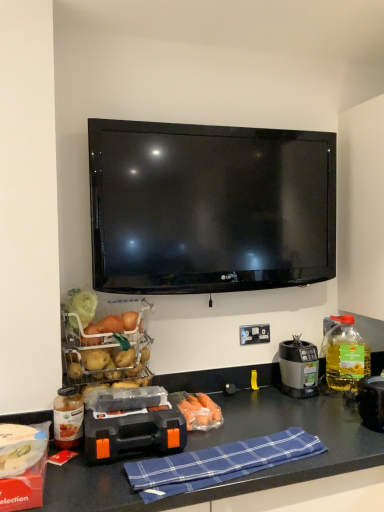
This screenshot has height=512, width=384. Identify the location of orange plastic toolbox at center. (134, 426).

Find the location of a particular element. black plastic blender at right is located at coordinates (298, 368).

Based on the photo, how much space does translucent glass jar at lower left, the first bottle in the front-to-back sequence, occupy vertically?

translucent glass jar at lower left, the first bottle in the front-to-back sequence, is 7.29 inches in height.

In order to face translucent glass jar at lower left, the 1th bottle in the left-to-right sequence, should I rotate leftwards or rightwards?

Turn left approximately 16.451 degrees to face it.

I want to click on yellow translucent bottle at right, the second bottle viewed from the left, so click(x=345, y=355).

The width and height of the screenshot is (384, 512). In order to click on orange plastic toolbox at center in this screenshot , I will do `click(134, 426)`.

Can you tell me how much black plastic electrical outlet at center and blue plaid cloth at lower center differ in facing direction?

6.62 degrees separate the facing orientations of black plastic electrical outlet at center and blue plaid cloth at lower center.

Who is shorter, black plastic electrical outlet at center or blue plaid cloth at lower center?

Standing shorter between the two is blue plaid cloth at lower center.

In order to click on material in front of the black plastic electrical outlet at center in this screenshot , I will do `click(218, 463)`.

Can you see black plastic electrical outlet at center touching blue plaid cloth at lower center?

No.

Which is less distant, (x=60, y=401) or (x=315, y=361)?

Clearly, point (x=60, y=401) is closer to the camera than point (x=315, y=361).

Looking at their sizes, would you say translucent glass jar at lower left, which appears as the 2th bottle when viewed from the back, is wider or thinner than black plastic blender at right?

Clearly, translucent glass jar at lower left, which appears as the 2th bottle when viewed from the back, has less width compared to black plastic blender at right.

Is translucent glass jar at lower left, which appears as the 2th bottle when viewed from the back, oriented away from black plastic blender at right?

No, translucent glass jar at lower left, which appears as the 2th bottle when viewed from the back, is not facing the opposite direction of black plastic blender at right.

Considering their positions, is translucent glass jar at lower left, which appears as the 2th bottle when viewed from the back, located in front of or behind black plastic blender at right?

Clearly, translucent glass jar at lower left, which appears as the 2th bottle when viewed from the back, is in front of black plastic blender at right.

Can you confirm if blue plaid cloth at lower center is smaller than orange plastic toolbox at center?

Correct, blue plaid cloth at lower center occupies less space than orange plastic toolbox at center.

Which is nearer, (148, 472) or (141, 440)?

Point (148, 472) is positioned closer to the camera compared to point (141, 440).

Looking at their sizes, would you say blue plaid cloth at lower center is wider or thinner than orange plastic toolbox at center?

Considering their sizes, blue plaid cloth at lower center looks slimmer than orange plastic toolbox at center.

Between yellow translucent bottle at right, which is the second bottle in front-to-back order, and black plastic blender at right, which one has larger width?

yellow translucent bottle at right, which is the second bottle in front-to-back order, is wider.

From a real-world perspective, is yellow translucent bottle at right, which ranks as the 1th bottle in back-to-front order, under black plastic blender at right?

No, from a real-world perspective, yellow translucent bottle at right, which ranks as the 1th bottle in back-to-front order, is not under black plastic blender at right.

Considering the sizes of objects yellow translucent bottle at right, the second bottle viewed from the left, and black plastic blender at right in the image provided, who is shorter, yellow translucent bottle at right, the second bottle viewed from the left, or black plastic blender at right?

Standing shorter between the two is black plastic blender at right.

Can you tell me how much translucent glass jar at lower left, the first bottle in the front-to-back sequence, and orange plastic toolbox at center differ in facing direction?

translucent glass jar at lower left, the first bottle in the front-to-back sequence, and orange plastic toolbox at center are facing 0.432 degrees away from each other.

Which point is more distant from viewer, (62, 394) or (90, 452)?

Point (62, 394)

Can you see translucent glass jar at lower left, the first bottle in the front-to-back sequence, touching orange plastic toolbox at center?

There is a gap between translucent glass jar at lower left, the first bottle in the front-to-back sequence, and orange plastic toolbox at center.

Considering the relative positions of translucent glass jar at lower left, which appears as the 2th bottle when viewed from the back, and orange plastic toolbox at center in the image provided, is translucent glass jar at lower left, which appears as the 2th bottle when viewed from the back, to the left of orange plastic toolbox at center from the viewer's perspective?

Yes.

Would you say matte red box at lower left is to the left or to the right of yellow translucent bottle at right, which is the second bottle in front-to-back order, in the picture?

matte red box at lower left is positioned on yellow translucent bottle at right, which is the second bottle in front-to-back order,'s left side.

From a real-world perspective, is matte red box at lower left on yellow translucent bottle at right, marked as the 1th bottle in a right-to-left arrangement?

No.

Which object is wider, matte red box at lower left or yellow translucent bottle at right, which is the second bottle in front-to-back order?

With larger width is matte red box at lower left.

From the image's perspective, which object appears higher, matte red box at lower left or yellow translucent bottle at right, the second bottle viewed from the left?

yellow translucent bottle at right, the second bottle viewed from the left, is shown above in the image.

From the image's perspective, which is above, black plastic blender at right or matte red box at lower left?

From the image's view, black plastic blender at right is above.

How far apart are black plastic blender at right and matte red box at lower left?

black plastic blender at right is 3.36 feet away from matte red box at lower left.

Based on the photo, how different are the orientations of black plastic blender at right and matte red box at lower left in degrees?

8.04 degrees.

Locate an element on the screen. This screenshot has height=512, width=384. kitchen appliance that appears on the right of matte red box at lower left is located at coordinates (298, 368).

Identify the location of material that is under the black plastic electrical outlet at center (from a real-world perspective). The width and height of the screenshot is (384, 512). [x=218, y=463].

Find the location of a particular element. bottle located below the black plastic blender at right (from the image's perspective) is located at coordinates (68, 418).

Which object lies nearer to the anchor point orange plastic toolbox at center, blue plaid cloth at lower center or yellow translucent bottle at right, which is the second bottle in front-to-back order?

Based on the image, blue plaid cloth at lower center appears to be nearer to orange plastic toolbox at center.

From the image, which object appears to be nearer to translucent glass jar at lower left, the 1th bottle in the left-to-right sequence, black plastic electrical outlet at center or black plastic blender at right?

Among the two, black plastic electrical outlet at center is located nearer to translucent glass jar at lower left, the 1th bottle in the left-to-right sequence.

Estimate the real-world distances between objects in this image. Which object is further from orange translucent carrots at center, matte red box at lower left or blue plaid cloth at lower center?

Among the two, matte red box at lower left is located further to orange translucent carrots at center.

Estimate the real-world distances between objects in this image. Which object is closer to orange translucent carrots at center, blue plaid cloth at lower center or black plastic blender at right?

blue plaid cloth at lower center lies closer to orange translucent carrots at center than the other object.

Based on their spatial positions, is black plastic blender at right or matte red box at lower left further from blue plaid cloth at lower center?

The object further to blue plaid cloth at lower center is black plastic blender at right.

Estimate the real-world distances between objects in this image. Which object is further from yellow translucent bottle at right, which ranks as the 1th bottle in back-to-front order, black plastic electrical outlet at center or matte red box at lower left?

matte red box at lower left.

Based on their spatial positions, is black plastic electrical outlet at center or orange plastic toolbox at center further from blue plaid cloth at lower center?

Based on the image, black plastic electrical outlet at center appears to be further to blue plaid cloth at lower center.

Considering their positions, is yellow translucent bottle at right, the second bottle viewed from the left, positioned further to matte red box at lower left than blue plaid cloth at lower center?

yellow translucent bottle at right, the second bottle viewed from the left, lies further to matte red box at lower left than the other object.

Locate an element on the screen. kitchen appliance situated between orange plastic toolbox at center and yellow translucent bottle at right, which is the second bottle in front-to-back order, from left to right is located at coordinates (298, 368).

I want to click on food located between orange plastic toolbox at center and yellow translucent bottle at right, the second bottle viewed from the left, in the left-right direction, so click(x=198, y=410).

Locate an element on the screen. The image size is (384, 512). material located between matte red box at lower left and black plastic blender at right in the left-right direction is located at coordinates (218, 463).

Where is `bottle between matte red box at lower left and black plastic blender at right from left to right`? The image size is (384, 512). bottle between matte red box at lower left and black plastic blender at right from left to right is located at coordinates (68, 418).